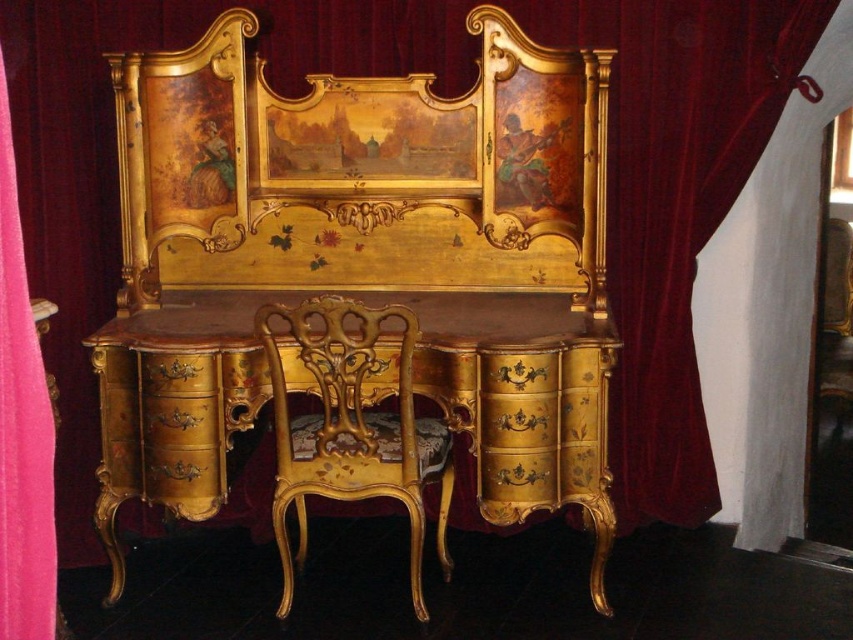
Question: Does gold painted desk at center appear under pink fabric curtain at left?

Choices:
 (A) no
 (B) yes

Answer: (B)

Question: Considering the relative positions of gold carved wood chair at center and pink fabric curtain at left in the image provided, where is gold carved wood chair at center located with respect to pink fabric curtain at left?

Choices:
 (A) right
 (B) left

Answer: (A)

Question: Which of these objects is positioned farthest from the pink fabric curtain at left?

Choices:
 (A) gold painted desk at center
 (B) gold carved wood chair at center

Answer: (A)

Question: Can you confirm if gold carved wood chair at center is thinner than pink fabric curtain at left?

Choices:
 (A) no
 (B) yes

Answer: (A)

Question: Which object appears farthest from the camera in this image?

Choices:
 (A) gold painted desk at center
 (B) pink fabric curtain at left
 (C) gold carved wood chair at center

Answer: (A)

Question: Which point is closer to the camera?

Choices:
 (A) (6, 102)
 (B) (297, 516)

Answer: (A)